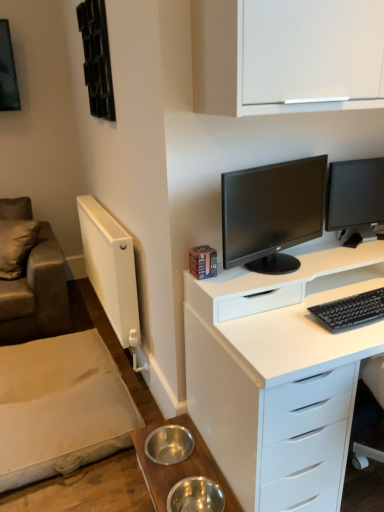
Question: Is white glossy desk at center situated inside black glossy monitor at right, the second computer monitor when ordered from left to right, or outside?

Choices:
 (A) inside
 (B) outside

Answer: (B)

Question: In terms of width, does white glossy desk at center look wider or thinner when compared to black glossy monitor at right, arranged as the first computer monitor when viewed from the right?

Choices:
 (A) thin
 (B) wide

Answer: (B)

Question: Estimate the real-world distances between objects in this image. Which object is closer to the black glossy monitor at right, the second computer monitor when ordered from left to right?

Choices:
 (A) black matte keyboard at right
 (B) white glossy desk at center
 (C) matte black monitor at center, which is the second computer monitor from right to left
 (D) metallic stainless steel bowls at lower center
 (E) leather-like brown couch at left

Answer: (C)

Question: Which object is the farthest from the leather-like brown couch at left?

Choices:
 (A) black glossy monitor at right, arranged as the first computer monitor when viewed from the right
 (B) metallic stainless steel bowls at lower center
 (C) beige fabric at lower left
 (D) white glossy desk at center
 (E) black matte keyboard at right

Answer: (E)